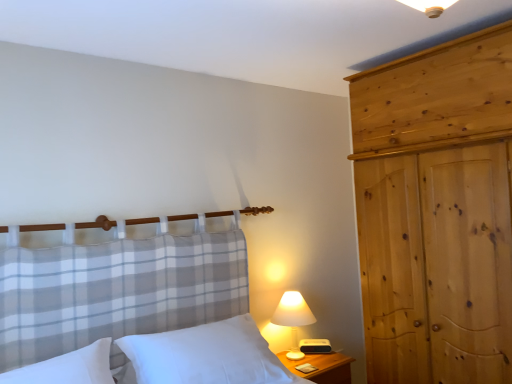
Question: Is white fabric lampshade at right not close to white soft pillow at lower left?

Choices:
 (A) yes
 (B) no

Answer: (A)

Question: Does white fabric lampshade at right lie in front of white soft pillow at lower left?

Choices:
 (A) no
 (B) yes

Answer: (A)

Question: From a real-world perspective, does white fabric lampshade at right stand above white soft pillow at lower left?

Choices:
 (A) yes
 (B) no

Answer: (B)

Question: Is white fabric lampshade at right aimed at white soft pillow at lower left?

Choices:
 (A) no
 (B) yes

Answer: (A)

Question: Is white fabric lampshade at right thinner than white soft pillow at lower left?

Choices:
 (A) yes
 (B) no

Answer: (A)

Question: From a real-world perspective, is white fabric lampshade at right physically below white soft pillow at lower left?

Choices:
 (A) yes
 (B) no

Answer: (A)

Question: Does wooden at right contain natural wood wardrobe at right?

Choices:
 (A) no
 (B) yes

Answer: (A)

Question: Does wooden at right have a lesser width compared to natural wood wardrobe at right?

Choices:
 (A) yes
 (B) no

Answer: (A)

Question: Would you say wooden at right is outside natural wood wardrobe at right?

Choices:
 (A) no
 (B) yes

Answer: (B)

Question: Is wooden at right turned away from natural wood wardrobe at right?

Choices:
 (A) no
 (B) yes

Answer: (A)

Question: Is wooden at right positioned behind natural wood wardrobe at right?

Choices:
 (A) yes
 (B) no

Answer: (A)

Question: Can you confirm if wooden at right is wider than natural wood wardrobe at right?

Choices:
 (A) yes
 (B) no

Answer: (B)

Question: Is white soft pillow at lower left taller than white fabric lampshade at right?

Choices:
 (A) no
 (B) yes

Answer: (A)